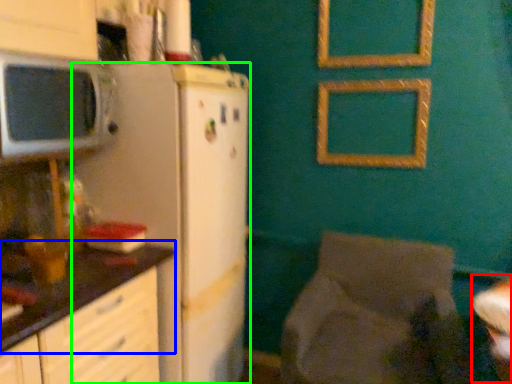
Question: Which object is positioned closest to table (highlighted by a red box)? Select from countertop (highlighted by a blue box) and refrigerator (highlighted by a green box).

Choices:
 (A) countertop
 (B) refrigerator

Answer: (B)